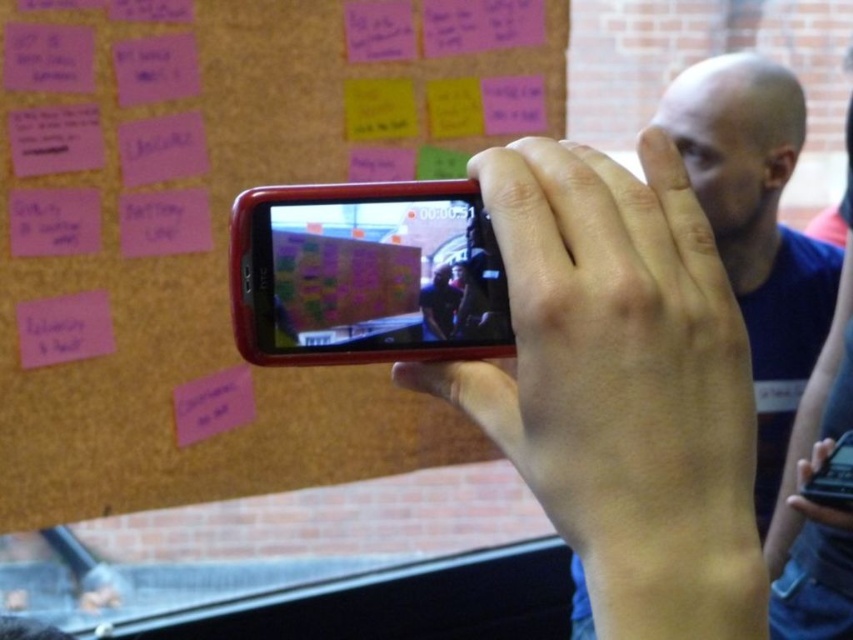
Does pink matte bulletin board at upper left have a smaller size compared to matte black phone at center?

No, pink matte bulletin board at upper left is not smaller than matte black phone at center.

Between point (198, 301) and point (236, 268), which one is positioned behind?

Positioned behind is point (198, 301).

What do you see at coordinates (218, 228) in the screenshot? I see `pink matte bulletin board at upper left` at bounding box center [218, 228].

I want to click on pink matte bulletin board at upper left, so click(x=218, y=228).

Image resolution: width=853 pixels, height=640 pixels. Describe the element at coordinates (622, 385) in the screenshot. I see `matte plastic hand at center` at that location.

Is matte plastic hand at center behind matte black phone at center?

→ No, it is in front of matte black phone at center.

Describe the element at coordinates (622, 385) in the screenshot. I see `matte plastic hand at center` at that location.

At what (x,y) coordinates should I click in order to perform the action: click on matte plastic hand at center. Please return your answer as a coordinate pair (x, y). The height and width of the screenshot is (640, 853). Looking at the image, I should click on (622, 385).

Is pink matte bulletin board at upper left to the right of matte plastic hand at center from the viewer's perspective?

In fact, pink matte bulletin board at upper left is to the left of matte plastic hand at center.

Can you confirm if pink matte bulletin board at upper left is thinner than matte plastic hand at center?

No, pink matte bulletin board at upper left is not thinner than matte plastic hand at center.

You are a GUI agent. You are given a task and a screenshot of the screen. Output one action in this format:
    pyautogui.click(x=<x>, y=<y>)
    Task: Click on the pink matte bulletin board at upper left
    
    Given the screenshot: What is the action you would take?
    pyautogui.click(x=218, y=228)

I want to click on pink matte bulletin board at upper left, so click(218, 228).